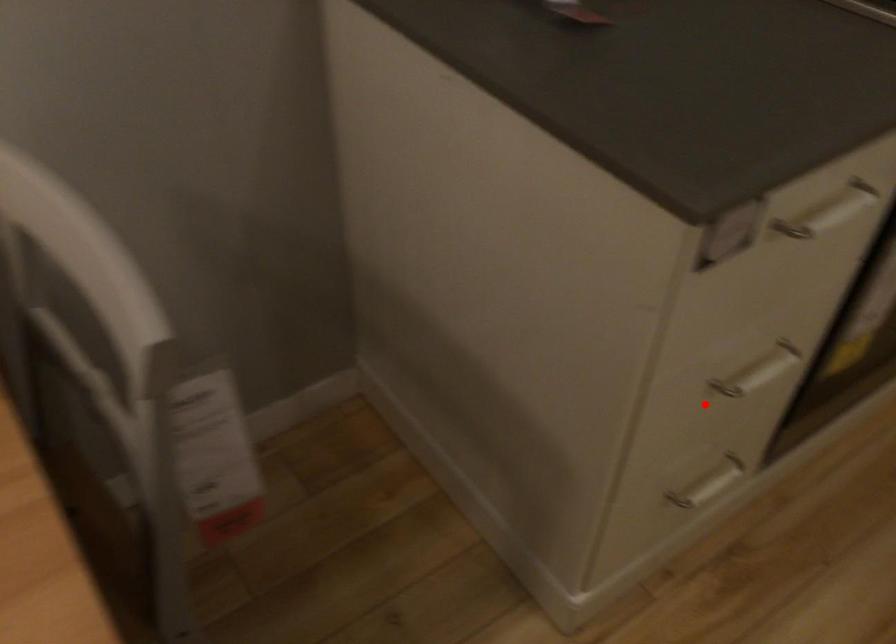
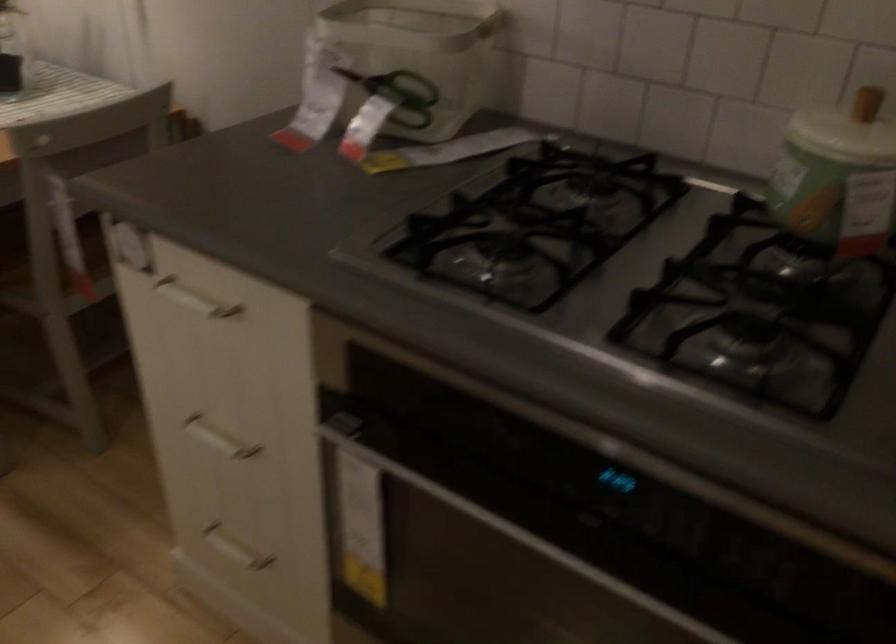
The point at the highlighted location is marked in the first image. Where is the corresponding point in the second image?

(218, 438)